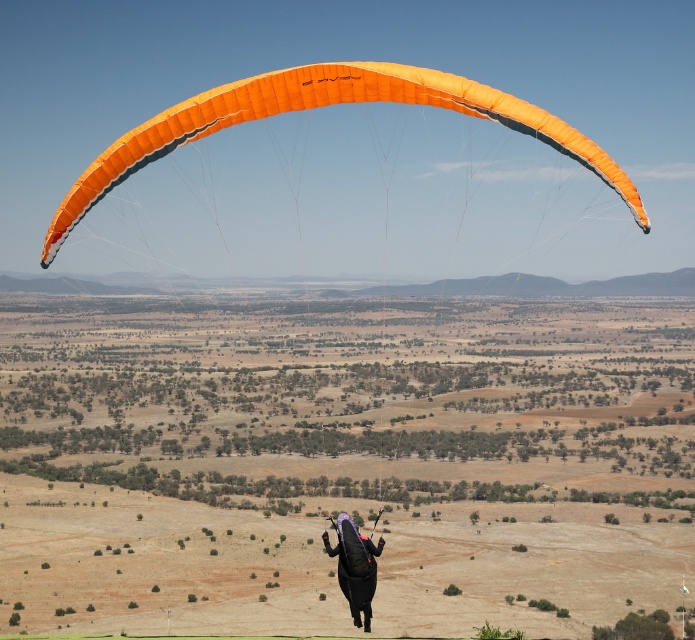
You are a pilot observing two parachutes in the sky. You see an orange fabric parachute at upper center and a purple matte parachute at center. Which parachute is wider?

The orange fabric parachute at upper center might be wider than the purple matte parachute at center.